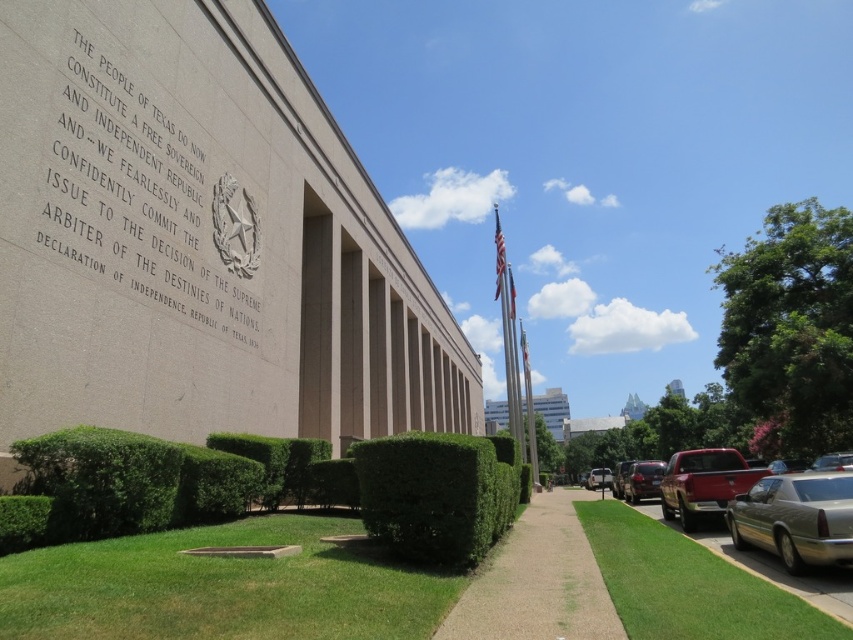
Question: Does metallic silver sedan at lower right have a smaller size compared to metallic gold car at lower right?

Choices:
 (A) no
 (B) yes

Answer: (A)

Question: Is green grass at lower right wider than american flag at upper center?

Choices:
 (A) yes
 (B) no

Answer: (A)

Question: Which object is positioned farthest from the black stone engraving at upper left?

Choices:
 (A) metallic gold car at lower right
 (B) satin silver sedan at lower right
 (C) light gray concrete sidewalk at center
 (D) green grass at lower right

Answer: (B)

Question: Which object is positioned farthest from the green grass at lower right?

Choices:
 (A) white fabric flag at upper center
 (B) american flag at upper center
 (C) metallic gold car at lower right
 (D) satin silver sedan at lower right

Answer: (A)

Question: Which point is closer to the camera?

Choices:
 (A) metallic silver sedan at lower right
 (B) american flag at upper center

Answer: (A)

Question: Where is green grass at lower center located in relation to satin silver sedan at lower right in the image?

Choices:
 (A) left
 (B) right

Answer: (A)